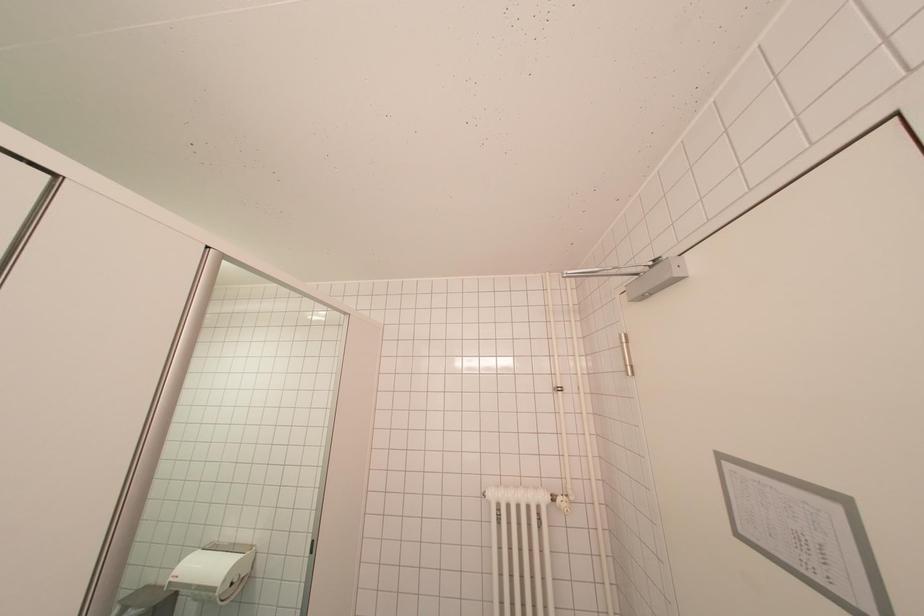
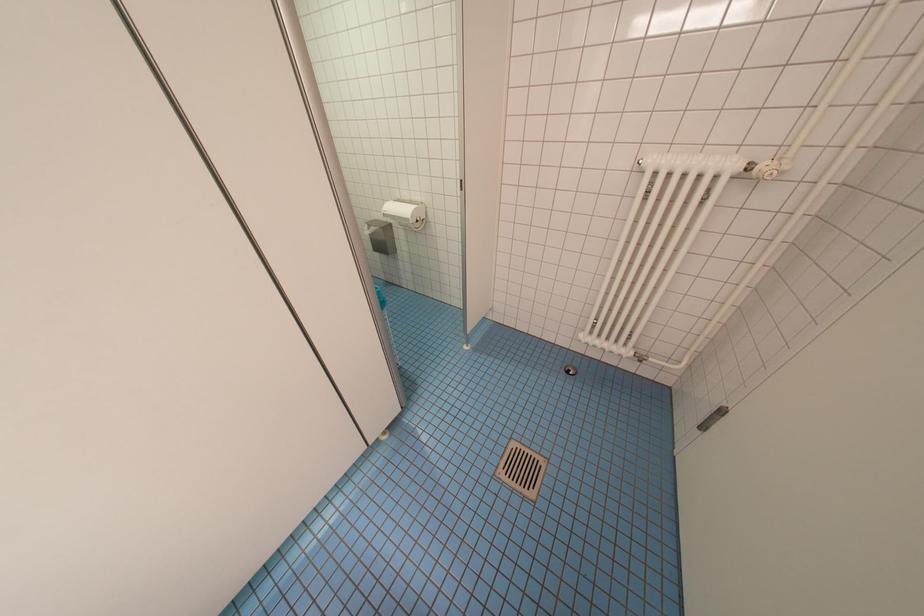
Based on the continuous images, in which direction is the camera rotating?

The rotation direction of the camera is left-down.